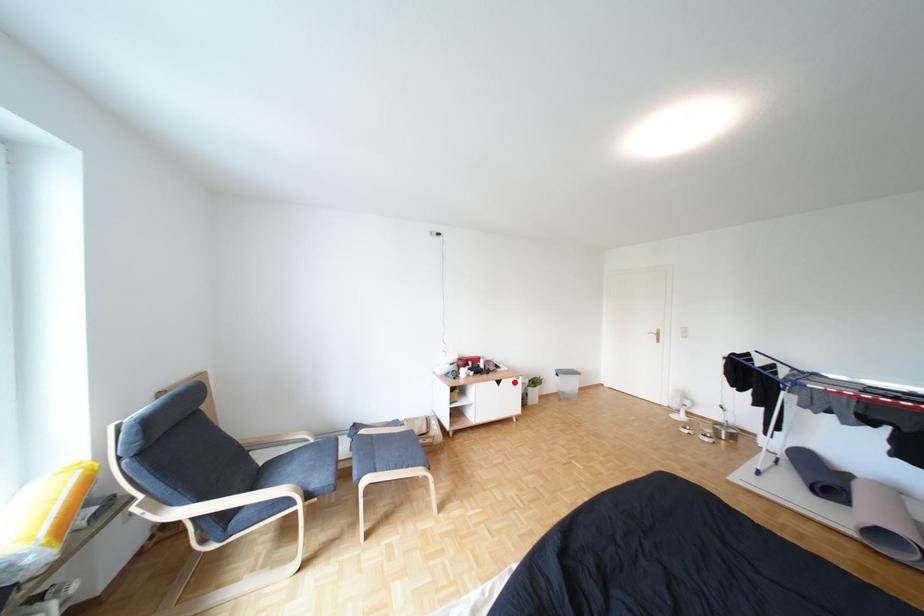
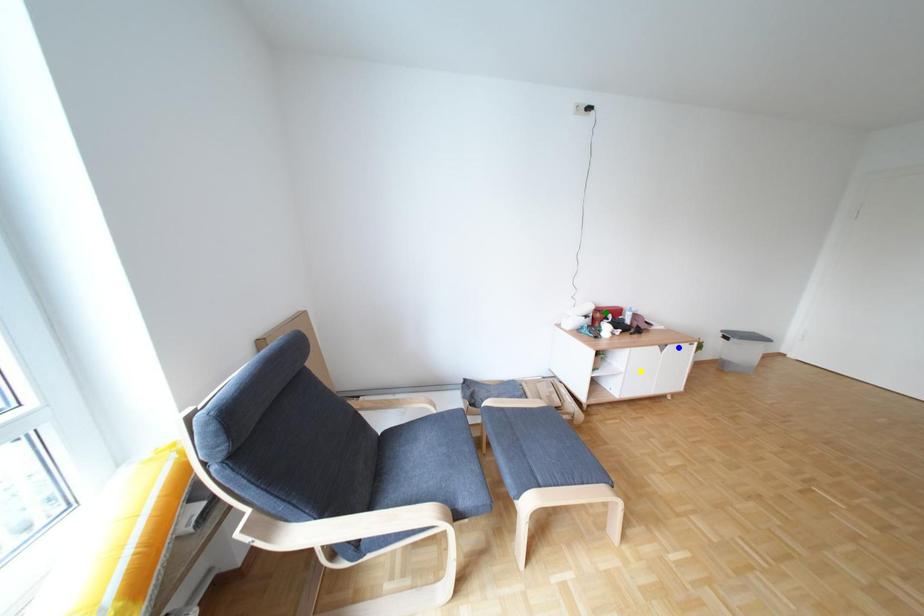
Question: I am providing you with two images of the same scene from different viewpoints. A red point is marked on the first image. You are given multiple points on the second image. Which point in image 2 is actually the same real-world point as the red point in image 1?

Choices:
 (A) yellow point
 (B) green point
 (C) blue point

Answer: (C)